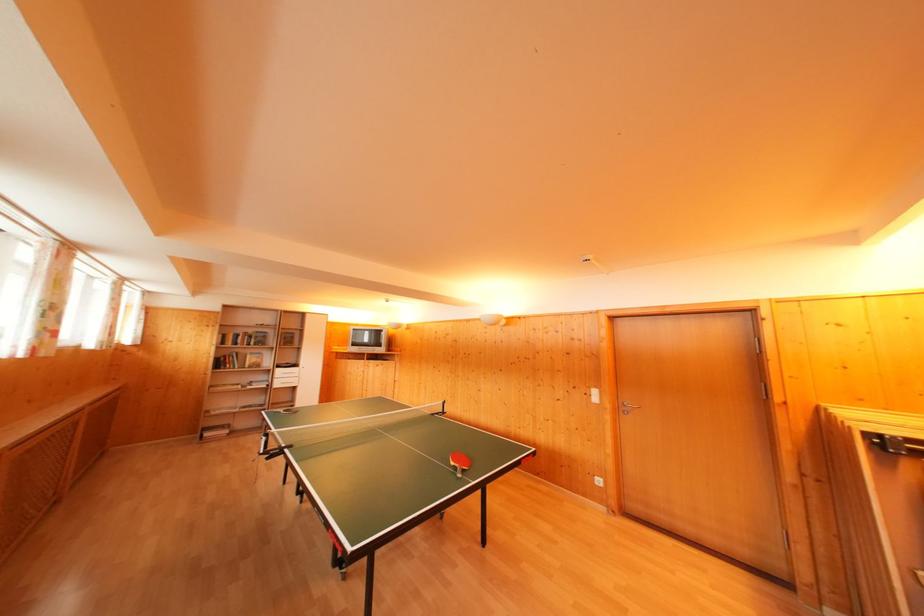
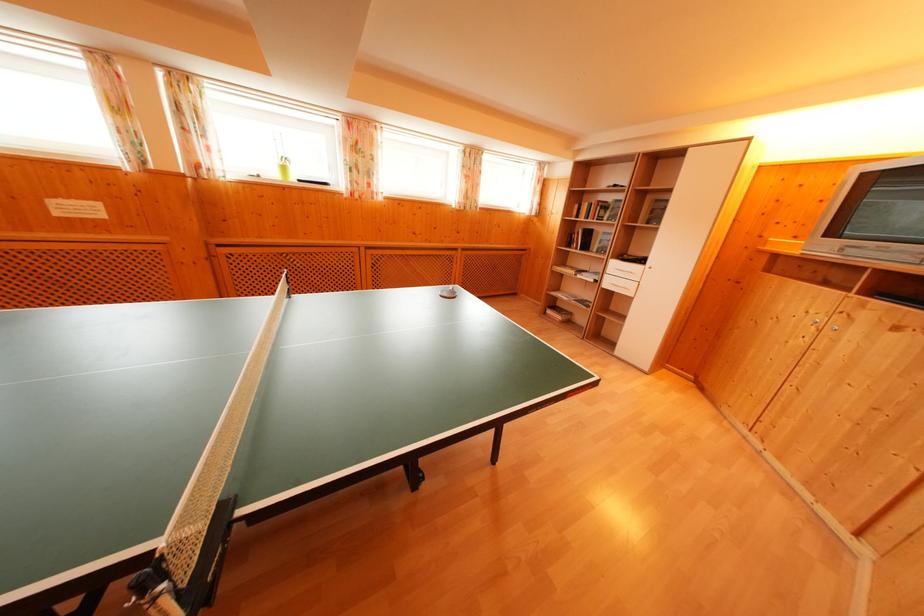
The point at (282, 381) is marked in the first image. Where is the corresponding point in the second image?

(614, 276)